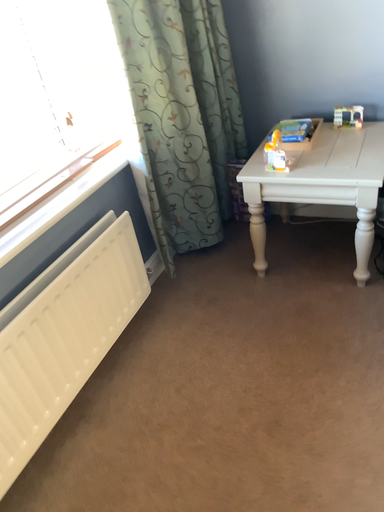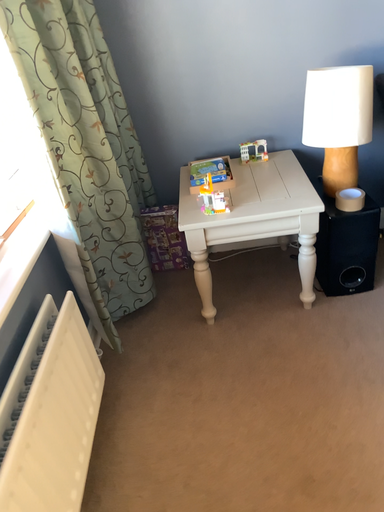
Question: Which way did the camera rotate in the video?

Choices:
 (A) rotated upward
 (B) rotated downward

Answer: (A)